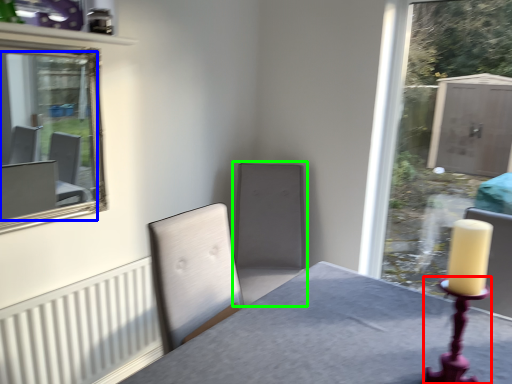
Question: Which object is positioned farthest from candle holder (highlighted by a red box)? Select from mirror (highlighted by a blue box) and swivel chair (highlighted by a green box).

Choices:
 (A) mirror
 (B) swivel chair

Answer: (A)